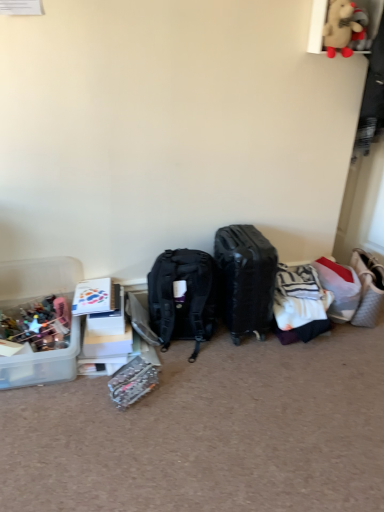
The height and width of the screenshot is (512, 384). Describe the element at coordinates (245, 279) in the screenshot. I see `black matte suitcase at center` at that location.

This screenshot has width=384, height=512. What do you see at coordinates (93, 297) in the screenshot?
I see `white plastic storage box at left` at bounding box center [93, 297].

This screenshot has width=384, height=512. In order to click on translucent plastic container at lower left in this screenshot , I will do `click(37, 280)`.

The image size is (384, 512). I want to click on black matte suitcase at center, so tap(245, 279).

How different are the orientations of translucent plastic container at lower left and black matte backpack at center in degrees?

4.73 degrees.

Can you confirm if translucent plastic container at lower left is positioned to the right of black matte backpack at center?

No.

From the image's perspective, is translucent plastic container at lower left under black matte backpack at center?

Yes, from the image's perspective, translucent plastic container at lower left is below black matte backpack at center.

Is point (66, 265) positioned behind point (166, 310)?

Yes.

From the picture: Is fluffy beige teddy bear at upper right not near black matte backpack at center?

Yes, fluffy beige teddy bear at upper right is far from black matte backpack at center.

I want to click on backpack on the left of fluffy beige teddy bear at upper right, so click(182, 297).

Is fluffy beige teddy bear at upper right looking in the opposite direction of black matte backpack at center?

fluffy beige teddy bear at upper right is not turned away from black matte backpack at center.

Is white plastic storage box at left not inside white striped fabric at center-right?

Absolutely, white plastic storage box at left is external to white striped fabric at center-right.

From the image's perspective, would you say white plastic storage box at left is shown under white striped fabric at center-right?

Actually, white plastic storage box at left appears above white striped fabric at center-right in the image.

In terms of height, does white plastic storage box at left look taller or shorter compared to white striped fabric at center-right?

Clearly, white plastic storage box at left is shorter compared to white striped fabric at center-right.

Would you say black matte suitcase at center is to the left or to the right of translucent plastic container at lower left in the picture?

Clearly, black matte suitcase at center is on the right of translucent plastic container at lower left in the image.

Is black matte suitcase at center far from translucent plastic container at lower left?

black matte suitcase at center is near translucent plastic container at lower left, not far away.

Considering the sizes of objects black matte suitcase at center and translucent plastic container at lower left in the image provided, who is thinner, black matte suitcase at center or translucent plastic container at lower left?

black matte suitcase at center is thinner.

Does black matte suitcase at center come in front of translucent plastic container at lower left?

That is False.

Is black matte suitcase at center positioned before clear plastic kit at lower center?

That is False.

From a real-world perspective, between black matte suitcase at center and clear plastic kit at lower center, who is vertically lower?

clear plastic kit at lower center.

Would you consider black matte suitcase at center to be distant from clear plastic kit at lower center?

No, black matte suitcase at center is not far from clear plastic kit at lower center.

The height and width of the screenshot is (512, 384). Identify the location of kit that is under the black matte suitcase at center (from a real-world perspective). (132, 382).

Between white striped fabric at center-right and black matte backpack at center, which one has larger width?

With larger width is white striped fabric at center-right.

Between white striped fabric at center-right and black matte backpack at center, which one has smaller size?

white striped fabric at center-right.

Are white striped fabric at center-right and black matte backpack at center making contact?

No, white striped fabric at center-right is not making contact with black matte backpack at center.

How much distance is there between white striped fabric at center-right and black matte backpack at center?

17.38 inches.

From a real-world perspective, is translucent plastic container at lower left physically located above or below white plastic storage box at left?

From a real-world perspective, translucent plastic container at lower left is physically below white plastic storage box at left.

Considering the sizes of objects translucent plastic container at lower left and white plastic storage box at left in the image provided, who is wider, translucent plastic container at lower left or white plastic storage box at left?

Wider between the two is translucent plastic container at lower left.

How different are the orientations of translucent plastic container at lower left and white plastic storage box at left in degrees?

The facing directions of translucent plastic container at lower left and white plastic storage box at left are 1.51 degrees apart.

Where is `backpack above the translucent plastic container at lower left (from the image's perspective)`? The width and height of the screenshot is (384, 512). backpack above the translucent plastic container at lower left (from the image's perspective) is located at coordinates (182, 297).

Locate an element on the screen. Image resolution: width=384 pixels, height=512 pixels. backpack that appears below the fluffy beige teddy bear at upper right (from the image's perspective) is located at coordinates (182, 297).

In the scene shown: When comparing their distances from white plastic storage box at left, does translucent plastic container at lower left or white quilted fabric handbag at right seem further?

white quilted fabric handbag at right is further to white plastic storage box at left.

Estimate the real-world distances between objects in this image. Which object is closer to white striped fabric at center-right, clear plastic kit at lower center or translucent plastic container at lower left?

The object closer to white striped fabric at center-right is clear plastic kit at lower center.

Looking at the image, which one is located further to white plastic storage box at left, black matte suitcase at center or clear plastic kit at lower center?

black matte suitcase at center.

Estimate the real-world distances between objects in this image. Which object is further from black matte suitcase at center, white striped fabric at center-right or translucent plastic container at lower left?

The object further to black matte suitcase at center is translucent plastic container at lower left.

When comparing their distances from black matte suitcase at center, does white striped fabric at center-right or black matte backpack at center seem closer?

black matte backpack at center.

Which object lies further to the anchor point fluffy beige teddy bear at upper right, black matte backpack at center or clear plastic kit at lower center?

clear plastic kit at lower center lies further to fluffy beige teddy bear at upper right than the other object.

Estimate the real-world distances between objects in this image. Which object is further from clear plastic kit at lower center, black matte suitcase at center or white striped fabric at center-right?

Based on the image, white striped fabric at center-right appears to be further to clear plastic kit at lower center.

From the image, which object appears to be farther from white striped fabric at center-right, black matte suitcase at center or clear plastic kit at lower center?

clear plastic kit at lower center lies further to white striped fabric at center-right than the other object.

You are a GUI agent. You are given a task and a screenshot of the screen. Output one action in this format:
    pyautogui.click(x=<x>, y=<y>)
    Task: Click on the kit located between white plastic storage box at left and black matte suitcase at center in the left-right direction
    The image size is (384, 512).
    Given the screenshot: What is the action you would take?
    pyautogui.click(x=132, y=382)

At what (x,y) coordinates should I click in order to perform the action: click on luggage and bags located between clear plastic kit at lower center and white striped fabric at center-right in the left-right direction. Please return your answer as a coordinate pair (x, y). Looking at the image, I should click on (245, 279).

This screenshot has height=512, width=384. I want to click on luggage and bags between white plastic storage box at left and white quilted fabric handbag at right in the horizontal direction, so click(x=245, y=279).

Find the location of a particular element. The image size is (384, 512). backpack located between white plastic storage box at left and white quilted fabric handbag at right in the left-right direction is located at coordinates (182, 297).